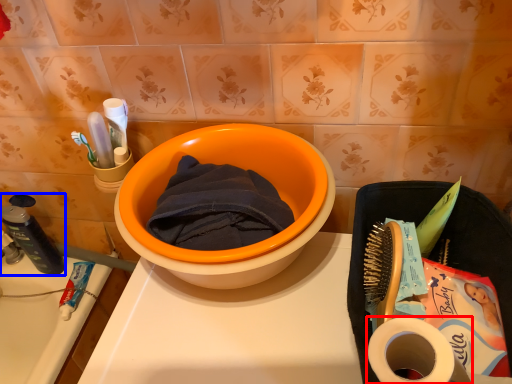
Question: Among these objects, which one is farthest to the camera, toilet paper (highlighted by a red box) or stationery (highlighted by a blue box)?

Choices:
 (A) toilet paper
 (B) stationery

Answer: (B)